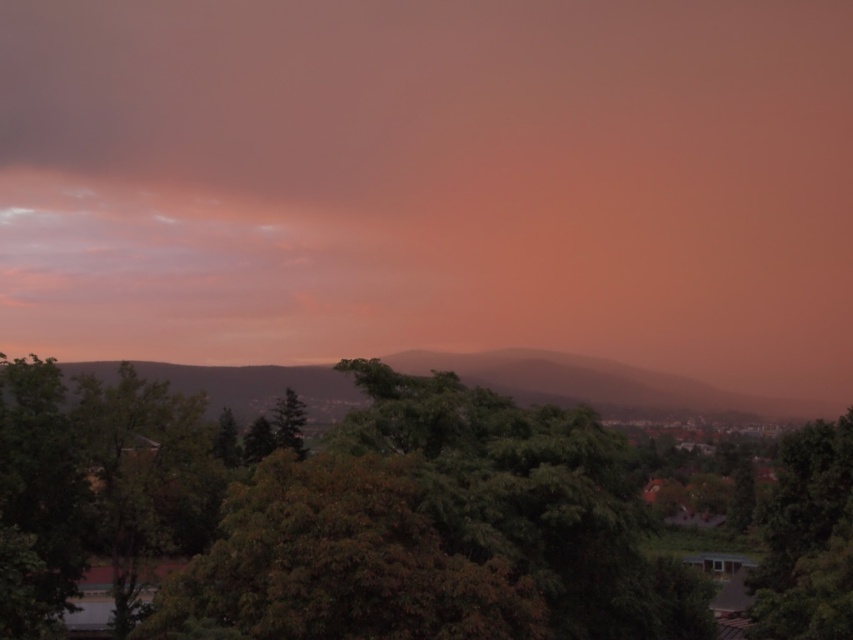
You are an environmental scientist analyzing the landscape. You observe the green leafy tree at center and the green matte tree at center. Which tree has a greater width?

The green leafy tree at center has a greater width than the green matte tree at center according to the description provided.

You are standing in the middle of a forest and see the green leafy tree at center and the green leafy tree at right. Which tree is positioned more towards the east if the sun is setting in the west?

The green leafy tree at right is positioned more towards the east because if the sun is setting in the west, the tree at the right would be casting a shadow towards the east, making it appear more to the east compared to the green leafy tree at center.

You are an artist sketching the landscape scene. You need to place the pink matte cloud at upper center and the green matte tree at center in your drawing. According to the scene, which object should be positioned to the right side in your sketch?

The pink matte cloud at upper center should be positioned to the right of the green matte tree at center in the sketch because the pink matte cloud at upper center is to the right of green matte tree at center according to the description.